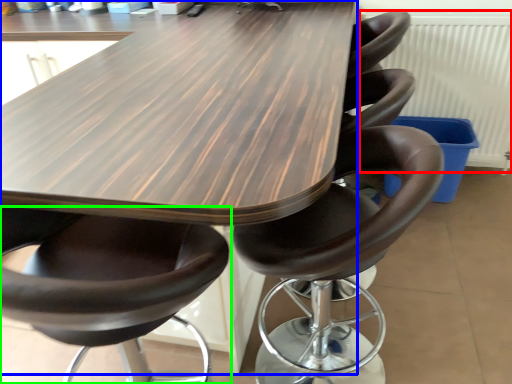
Question: Which object is positioned closest to radiator (highlighted by a red box)? Select from table (highlighted by a blue box) and chair (highlighted by a green box).

Choices:
 (A) table
 (B) chair

Answer: (A)